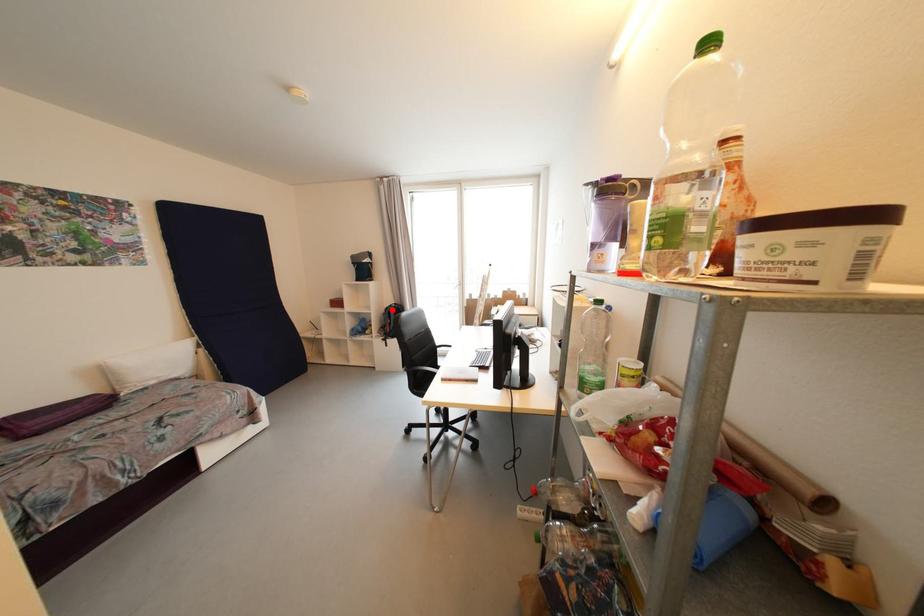
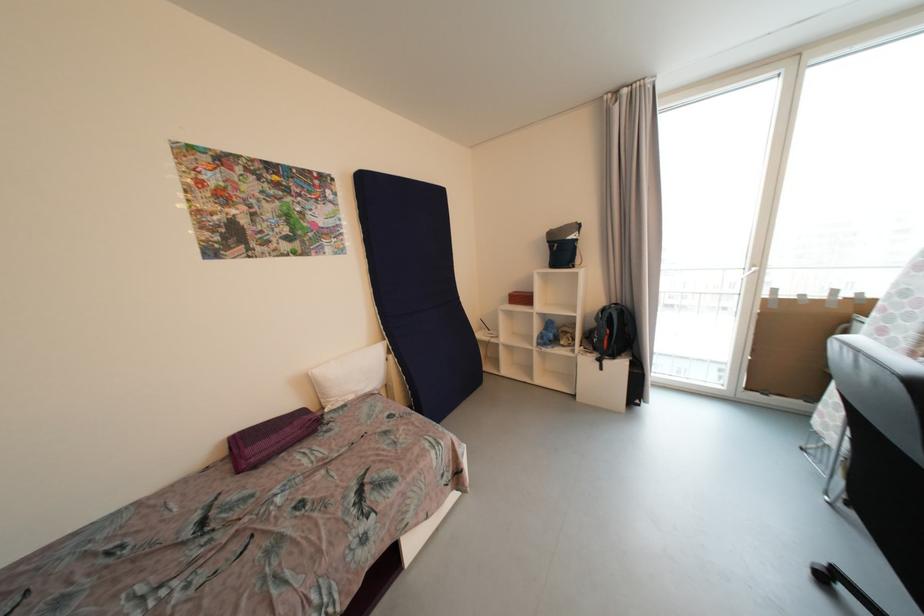
Question: A red point is marked in image1. In image2, is the corresponding 3D point closer to the camera or farther? Reply with the corresponding letter.

Choices:
 (A) The corresponding 3D point is closer.
 (B) The corresponding 3D point is farther.

Answer: (A)